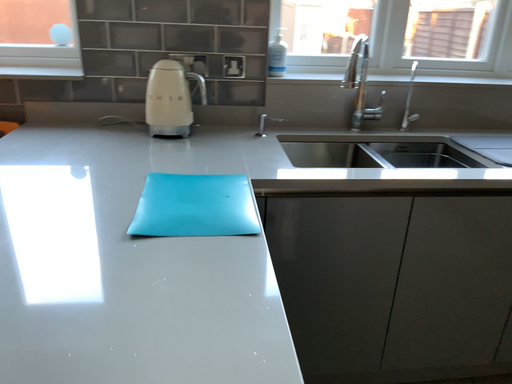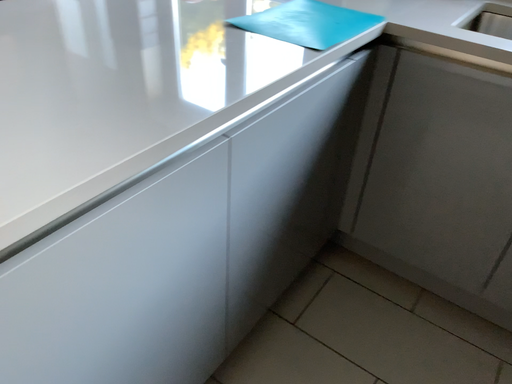
Question: Which way did the camera rotate in the video?

Choices:
 (A) rotated left
 (B) rotated right

Answer: (A)